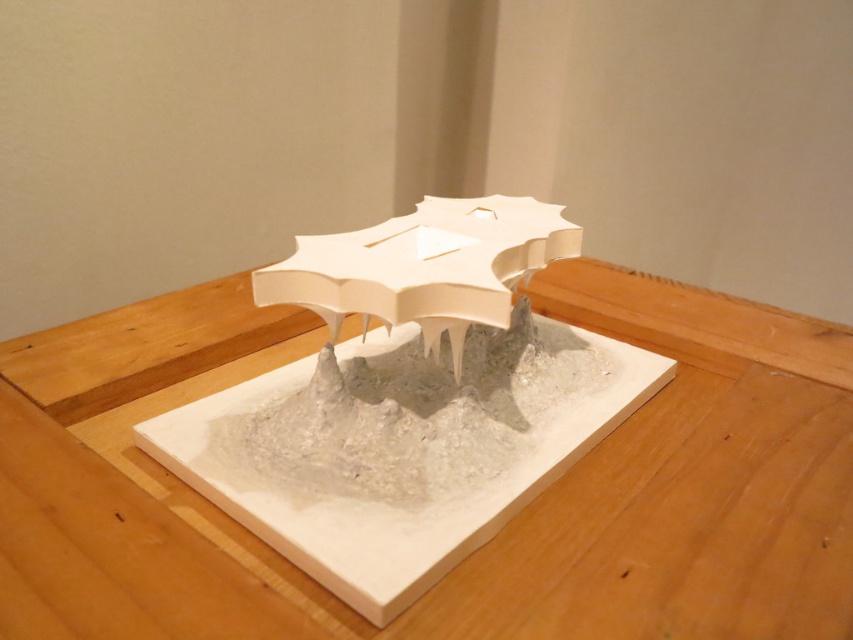
Can you confirm if white matte table at center is taller than matte white umbrella at center?

Correct, white matte table at center is much taller as matte white umbrella at center.

Between point (473, 636) and point (515, 280), which one is positioned in front?

Point (473, 636) is more forward.

Who is more forward, (x=776, y=380) or (x=340, y=273)?

Point (x=340, y=273)

What are the coordinates of `white matte table at center` in the screenshot? It's located at (492, 538).